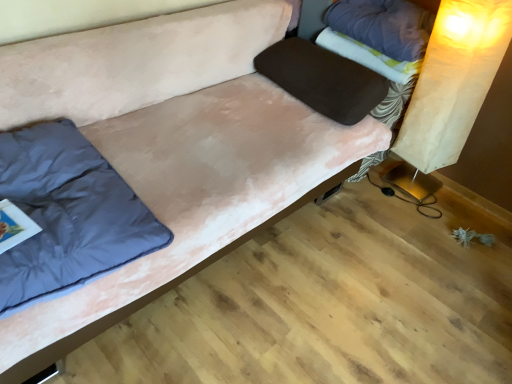
The image size is (512, 384). Describe the element at coordinates (368, 56) in the screenshot. I see `fluffy white blanket at upper right` at that location.

The height and width of the screenshot is (384, 512). Describe the element at coordinates (464, 98) in the screenshot. I see `matte paper lampshade at right` at that location.

How much space does dark blue fabric pillow at left, marked as the 3th pillow in a right-to-left arrangement, occupy vertically?

19.09 centimeters.

This screenshot has height=384, width=512. What do you see at coordinates (323, 79) in the screenshot?
I see `velvet brown pillow at center, the 2th pillow from the right` at bounding box center [323, 79].

Where is `fluffy white blanket at upper right`? fluffy white blanket at upper right is located at coordinates point(368,56).

Is point (21, 208) behind point (508, 173)?

No, it is not.

Considering their positions, is dark blue fabric pillow at left, the first pillow from the left, located in front of or behind matte paper lampshade at right?

dark blue fabric pillow at left, the first pillow from the left, is positioned closer to the viewer than matte paper lampshade at right.

Would you say dark blue fabric pillow at left, the first pillow from the left, is outside matte paper lampshade at right?

Yes, dark blue fabric pillow at left, the first pillow from the left, is located beyond the bounds of matte paper lampshade at right.

Are dark blue fabric pillow at left, the first pillow from the left, and matte paper lampshade at right beside each other?

No.

Could fluffy white blanket at upper right be considered to be inside dark blue fabric pillow at left, the first pillow from the left?

No, fluffy white blanket at upper right is not inside dark blue fabric pillow at left, the first pillow from the left.

Does dark blue fabric pillow at left, the first pillow from the left, have a lesser width compared to fluffy white blanket at upper right?

No.

Does dark blue fabric pillow at left, the first pillow from the left, touch fluffy white blanket at upper right?

No, dark blue fabric pillow at left, the first pillow from the left, is not next to fluffy white blanket at upper right.

Can you confirm if dark blue fabric pillow at left, marked as the 3th pillow in a right-to-left arrangement, is positioned to the right of fluffy white blanket at upper right?

No, dark blue fabric pillow at left, marked as the 3th pillow in a right-to-left arrangement, is not to the right of fluffy white blanket at upper right.

There is a dark blue fabric pillow at left, the first pillow from the left. Find the location of `the 1st pillow above it (from a real-world perspective)`. the 1st pillow above it (from a real-world perspective) is located at coordinates point(323,79).

Considering the relative sizes of velvet brown pillow at center, the 2th pillow from the right, and dark blue fabric pillow at left, the first pillow from the left, in the image provided, is velvet brown pillow at center, the 2th pillow from the right, shorter than dark blue fabric pillow at left, the first pillow from the left,?

Incorrect, the height of velvet brown pillow at center, the 2th pillow from the right, does not fall short of that of dark blue fabric pillow at left, the first pillow from the left.

Between point (325, 114) and point (97, 243), which one is positioned in front?

Positioned in front is point (97, 243).

Is velvet brown pillow at center, which is counted as the 2th pillow, starting from the left, at the right side of dark blue fabric pillow at left, marked as the 3th pillow in a right-to-left arrangement?

Indeed, velvet brown pillow at center, which is counted as the 2th pillow, starting from the left, is positioned on the right side of dark blue fabric pillow at left, marked as the 3th pillow in a right-to-left arrangement.

Is fluffy white blanket at upper right to the left or to the right of velvet brown pillow at center, which is counted as the 2th pillow, starting from the left, in the image?

From the image, it's evident that fluffy white blanket at upper right is to the right of velvet brown pillow at center, which is counted as the 2th pillow, starting from the left.

Is fluffy white blanket at upper right taller than velvet brown pillow at center, which is counted as the 2th pillow, starting from the left?

No, fluffy white blanket at upper right is not taller than velvet brown pillow at center, which is counted as the 2th pillow, starting from the left.

Can you confirm if fluffy white blanket at upper right is bigger than velvet brown pillow at center, which is counted as the 2th pillow, starting from the left?

No.

Does velvet brown pillow at center, the 2th pillow from the right, have a larger size compared to purple fabric pillow at upper right, which is counted as the first pillow, starting from the right?

Yes.

Consider the image. In terms of width, does velvet brown pillow at center, the 2th pillow from the right, look wider or thinner when compared to purple fabric pillow at upper right, which is counted as the first pillow, starting from the right?

Considering their sizes, velvet brown pillow at center, the 2th pillow from the right, looks broader than purple fabric pillow at upper right, which is counted as the first pillow, starting from the right.

Locate an element on the screen. Image resolution: width=512 pixels, height=384 pixels. the 1st pillow to the left of the fluffy white blanket at upper right, counting from the anchor's position is located at coordinates (323, 79).

Is velvet brown pillow at center, which is counted as the 2th pillow, starting from the left, oriented towards fluffy white blanket at upper right?

No, velvet brown pillow at center, which is counted as the 2th pillow, starting from the left, is not turned towards fluffy white blanket at upper right.

Between velvet brown pillow at center, the 2th pillow from the right, and fluffy white blanket at upper right, which one has larger size?

With larger size is velvet brown pillow at center, the 2th pillow from the right.

Is velvet brown pillow at center, the 2th pillow from the right, far away from fluffy white blanket at upper right?

No, velvet brown pillow at center, the 2th pillow from the right, is not far from fluffy white blanket at upper right.

Which is less distant, (x=71, y=207) or (x=409, y=53)?

Point (x=71, y=207) appears to be closer to the viewer than point (x=409, y=53).

Which is more to the left, dark blue fabric pillow at left, marked as the 3th pillow in a right-to-left arrangement, or purple fabric pillow at upper right, which is the third pillow in left-to-right order?

Positioned to the left is dark blue fabric pillow at left, marked as the 3th pillow in a right-to-left arrangement.

Is dark blue fabric pillow at left, the first pillow from the left, aimed at purple fabric pillow at upper right, which is counted as the first pillow, starting from the right?

No, dark blue fabric pillow at left, the first pillow from the left, is not facing towards purple fabric pillow at upper right, which is counted as the first pillow, starting from the right.

Would you say dark blue fabric pillow at left, marked as the 3th pillow in a right-to-left arrangement, is inside or outside purple fabric pillow at upper right, which is counted as the first pillow, starting from the right?

dark blue fabric pillow at left, marked as the 3th pillow in a right-to-left arrangement, is not enclosed by purple fabric pillow at upper right, which is counted as the first pillow, starting from the right.

Where is `pillow below the matte paper lampshade at right (from a real-world perspective)`? The image size is (512, 384). pillow below the matte paper lampshade at right (from a real-world perspective) is located at coordinates (68, 213).

Identify the location of the 3rd pillow in front of the fluffy white blanket at upper right. This screenshot has height=384, width=512. (68, 213).

Which object lies nearer to the anchor point dark blue fabric pillow at left, marked as the 3th pillow in a right-to-left arrangement, fluffy white blanket at upper right or matte paper lampshade at right?

fluffy white blanket at upper right is positioned closer to the anchor dark blue fabric pillow at left, marked as the 3th pillow in a right-to-left arrangement.

Looking at the image, which one is located further to dark blue fabric pillow at left, the first pillow from the left, velvet brown pillow at center, the 2th pillow from the right, or matte paper lampshade at right?

matte paper lampshade at right is further to dark blue fabric pillow at left, the first pillow from the left.

Looking at the image, which one is located further to dark blue fabric pillow at left, marked as the 3th pillow in a right-to-left arrangement, purple fabric pillow at upper right, which is counted as the first pillow, starting from the right, or velvet brown pillow at center, which is counted as the 2th pillow, starting from the left?

purple fabric pillow at upper right, which is counted as the first pillow, starting from the right, lies further to dark blue fabric pillow at left, marked as the 3th pillow in a right-to-left arrangement, than the other object.

From the image, which object appears to be nearer to fluffy white blanket at upper right, purple fabric pillow at upper right, which is counted as the first pillow, starting from the right, or matte paper lampshade at right?

Based on the image, purple fabric pillow at upper right, which is counted as the first pillow, starting from the right, appears to be nearer to fluffy white blanket at upper right.

From the image, which object appears to be nearer to matte paper lampshade at right, fluffy white blanket at upper right or velvet brown pillow at center, which is counted as the 2th pillow, starting from the left?

fluffy white blanket at upper right is positioned closer to the anchor matte paper lampshade at right.

Looking at the image, which one is located closer to fluffy white blanket at upper right, dark blue fabric pillow at left, the first pillow from the left, or velvet brown pillow at center, the 2th pillow from the right?

velvet brown pillow at center, the 2th pillow from the right, lies closer to fluffy white blanket at upper right than the other object.

Based on their spatial positions, is dark blue fabric pillow at left, marked as the 3th pillow in a right-to-left arrangement, or purple fabric pillow at upper right, which is counted as the first pillow, starting from the right, closer to matte paper lampshade at right?

Among the two, purple fabric pillow at upper right, which is counted as the first pillow, starting from the right, is located nearer to matte paper lampshade at right.

Looking at the image, which one is located further to matte paper lampshade at right, fluffy white blanket at upper right or dark blue fabric pillow at left, marked as the 3th pillow in a right-to-left arrangement?

The object further to matte paper lampshade at right is dark blue fabric pillow at left, marked as the 3th pillow in a right-to-left arrangement.

Identify the location of pillow located between velvet brown pillow at center, the 2th pillow from the right, and matte paper lampshade at right in the left-right direction. This screenshot has height=384, width=512. (383, 26).

Find the location of a particular element. This screenshot has width=512, height=384. blanket between dark blue fabric pillow at left, marked as the 3th pillow in a right-to-left arrangement, and purple fabric pillow at upper right, which is the third pillow in left-to-right order is located at coordinates (368, 56).

You are a GUI agent. You are given a task and a screenshot of the screen. Output one action in this format:
    pyautogui.click(x=<x>, y=<y>)
    Task: Click on the blanket between purple fabric pillow at upper right, which is counted as the first pillow, starting from the right, and matte paper lampshade at right vertically
    This screenshot has height=384, width=512.
    Given the screenshot: What is the action you would take?
    pyautogui.click(x=368, y=56)

Identify the location of blanket between dark blue fabric pillow at left, marked as the 3th pillow in a right-to-left arrangement, and matte paper lampshade at right, in the horizontal direction. (368, 56).